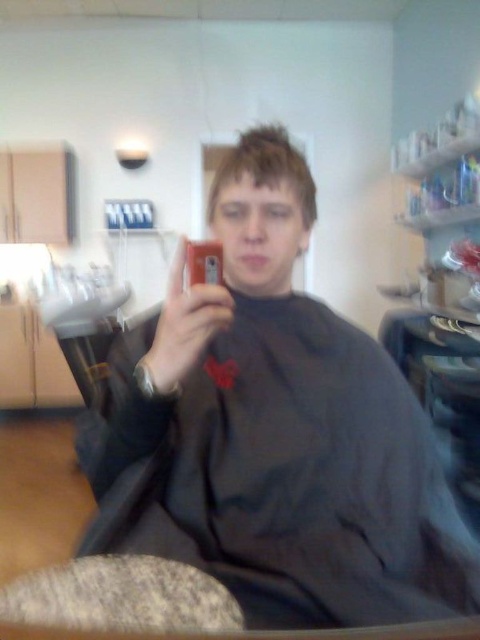
Who is taller, spiky brown hair at center or matte black phone at center?

Standing taller between the two is spiky brown hair at center.

Does spiky brown hair at center have a larger size compared to matte black phone at center?

Indeed, spiky brown hair at center has a larger size compared to matte black phone at center.

Image resolution: width=480 pixels, height=640 pixels. In order to click on spiky brown hair at center in this screenshot , I will do `click(266, 168)`.

Where is `spiky brown hair at center`? This screenshot has height=640, width=480. spiky brown hair at center is located at coordinates (266, 168).